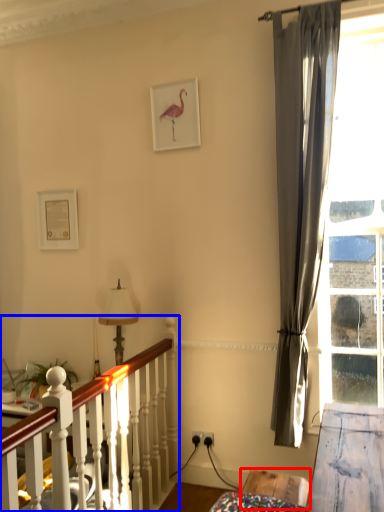
Question: Which object is closer to the camera taking this photo, furniture (highlighted by a red box) or bed frame (highlighted by a blue box)?

Choices:
 (A) furniture
 (B) bed frame

Answer: (B)